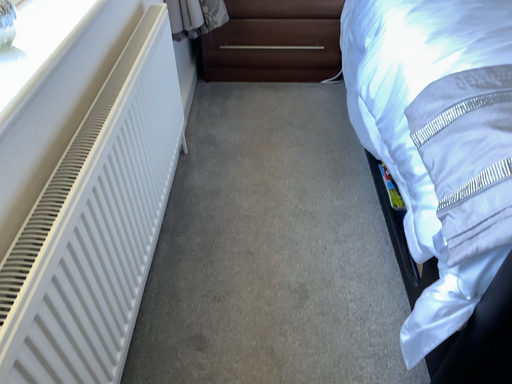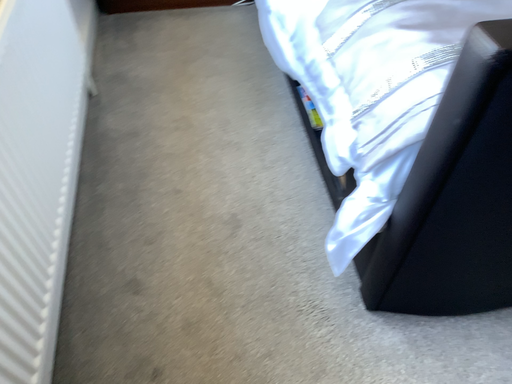
Question: Which way did the camera rotate in the video?

Choices:
 (A) rotated left
 (B) rotated right

Answer: (B)